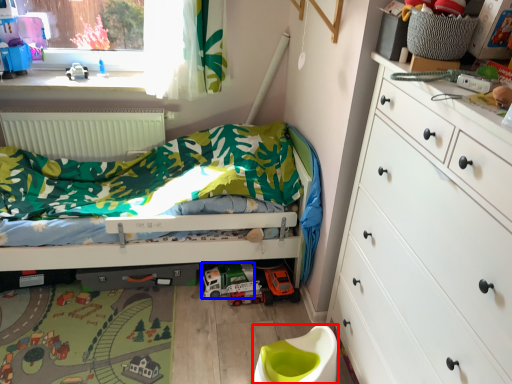
Question: Which of the following is the closest to the observer, toilet bowl (highlighted by a red box) or toy car (highlighted by a blue box)?

Choices:
 (A) toilet bowl
 (B) toy car

Answer: (A)